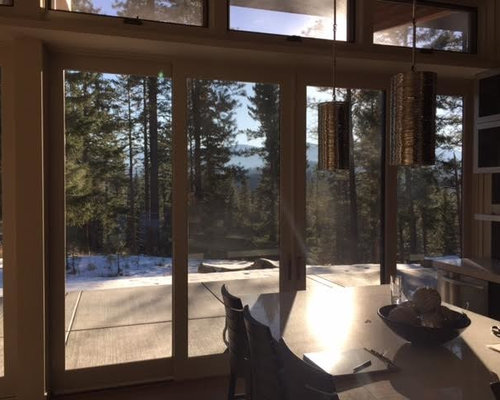
Identify the location of table. Image resolution: width=500 pixels, height=400 pixels. (329, 336).